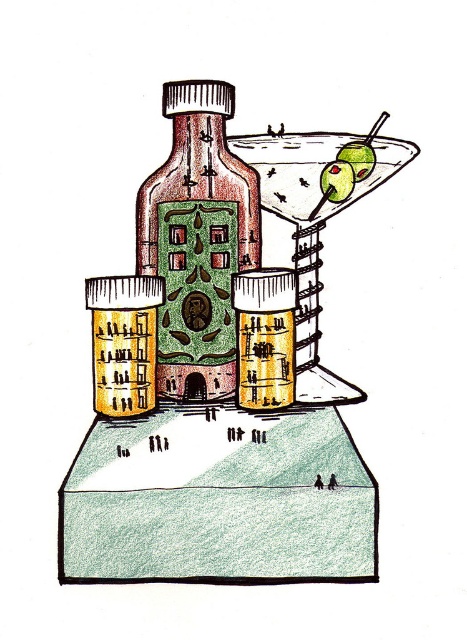
Does shiny glass martini at upper right have a lesser width compared to green matte olive at upper right?

Incorrect, shiny glass martini at upper right's width is not less than green matte olive at upper right's.

Between shiny glass martini at upper right and green matte olive at upper right, which one has less height?

green matte olive at upper right is shorter.

Where is `shiny glass martini at upper right`? The width and height of the screenshot is (467, 640). shiny glass martini at upper right is located at coordinates [312, 227].

Is shiny glass martini at upper right to the right of green matte olive at upper center from the viewer's perspective?

In fact, shiny glass martini at upper right is to the left of green matte olive at upper center.

Who is taller, shiny glass martini at upper right or green matte olive at upper center?

With more height is shiny glass martini at upper right.

Between point (302, 380) and point (349, 192), which one is positioned behind?

The point (349, 192) is behind.

What are the coordinates of `shiny glass martini at upper right` in the screenshot? It's located at (312, 227).

Which is below, matte glass bottle at center or green matte olive at upper center?

matte glass bottle at center is lower down.

Which is above, matte glass bottle at center or green matte olive at upper center?

green matte olive at upper center is higher up.

Where is `matte glass bottle at center`? This screenshot has width=467, height=640. matte glass bottle at center is located at coordinates (198, 241).